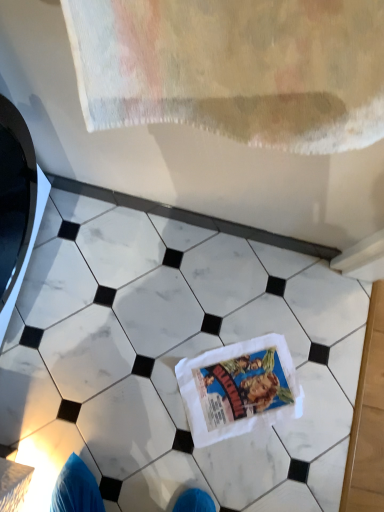
What do you see at coordinates (238, 388) in the screenshot? This screenshot has width=384, height=512. I see `white cotton comic book at center` at bounding box center [238, 388].

What are the coordinates of `white cotton comic book at center` in the screenshot? It's located at (238, 388).

Where is `white marble tile at center`? Image resolution: width=384 pixels, height=512 pixels. white marble tile at center is located at coordinates (174, 353).

What do you see at coordinates (174, 353) in the screenshot? This screenshot has height=512, width=384. I see `white marble tile at center` at bounding box center [174, 353].

Identify the location of white cotton comic book at center. The image size is (384, 512). (238, 388).

In the image, is white marble tile at center on the left side or the right side of white cotton comic book at center?

Based on their positions, white marble tile at center is located to the left of white cotton comic book at center.

Which object is closer to the camera taking this photo, white marble tile at center or white cotton comic book at center?

white marble tile at center is in front.

Which is closer to the camera, (292,289) or (230,392)?

Positioned in front is point (230,392).

From the image's perspective, between white marble tile at center and white cotton comic book at center, who is located below?

white cotton comic book at center appears lower in the image.

From a real-world perspective, relative to white cotton comic book at center, is white marble tile at center vertically above or below?

white marble tile at center is situated lower than white cotton comic book at center in the real world.

Looking at their sizes, would you say white marble tile at center is wider or thinner than white cotton comic book at center?

white marble tile at center is wider than white cotton comic book at center.

Does white marble tile at center have a lesser height compared to white cotton comic book at center?

No.

Consider the image. Who is bigger, white marble tile at center or white cotton comic book at center?

Bigger between the two is white marble tile at center.

Is white marble tile at center inside the boundaries of white cotton comic book at center, or outside?

A: white marble tile at center lies outside white cotton comic book at center.

Does white marble tile at center touch white cotton comic book at center?

white marble tile at center is not next to white cotton comic book at center, and they're not touching.

Is white marble tile at center facing away from white cotton comic book at center?

Yes, white marble tile at center's orientation is away from white cotton comic book at center.

What's the angular difference between white marble tile at center and white cotton comic book at center's facing directions?

The angle between the facing direction of white marble tile at center and the facing direction of white cotton comic book at center is 61.5 degrees.

How much distance is there between white marble tile at center and white cotton comic book at center?

The distance of white marble tile at center from white cotton comic book at center is 15.38 centimeters.

The height and width of the screenshot is (512, 384). I want to click on marble that appears above the white cotton comic book at center (from the image's perspective), so tap(174, 353).

Does white cotton comic book at center appear on the right side of white marble tile at center?

Yes, white cotton comic book at center is to the right of white marble tile at center.

Is white cotton comic book at center in front of or behind white marble tile at center in the image?

white cotton comic book at center is positioned farther from the viewer than white marble tile at center.

Is point (261, 408) closer or farther from the camera than point (156, 307)?

Point (261, 408).

From the image's perspective, which one is positioned higher, white cotton comic book at center or white marble tile at center?

white marble tile at center is shown above in the image.

Looking at this image, from a real-world perspective, is white cotton comic book at center beneath white marble tile at center?

Actually, white cotton comic book at center is physically above white marble tile at center in the real world.

Based on the photo, does white cotton comic book at center have a lesser width compared to white marble tile at center?

Correct, the width of white cotton comic book at center is less than that of white marble tile at center.

Is white cotton comic book at center shorter than white marble tile at center?

Indeed, white cotton comic book at center has a lesser height compared to white marble tile at center.

Which of these two, white cotton comic book at center or white marble tile at center, is smaller?

Smaller between the two is white cotton comic book at center.

Would you say white cotton comic book at center is inside or outside white marble tile at center?

white cotton comic book at center fits inside white marble tile at center.

Would you consider white cotton comic book at center to be distant from white marble tile at center?

They are positioned close to each other.

Is white cotton comic book at center oriented away from white marble tile at center?

Yes.

Image resolution: width=384 pixels, height=512 pixels. Find the location of `marble below the white cotton comic book at center (from a real-world perspective)`. marble below the white cotton comic book at center (from a real-world perspective) is located at coordinates (174, 353).

What are the coordinates of `marble lying on the left of white cotton comic book at center` in the screenshot? It's located at (174, 353).

Image resolution: width=384 pixels, height=512 pixels. I want to click on comic book below the white marble tile at center (from the image's perspective), so 238,388.